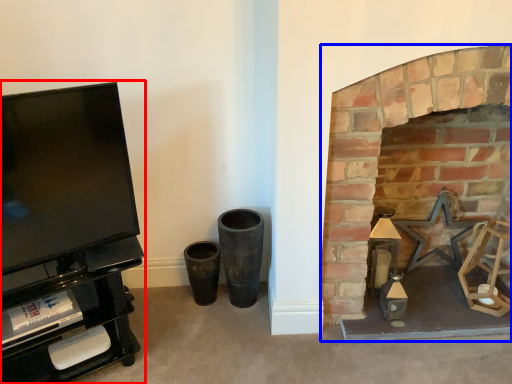
Question: Which object appears farthest to the camera in this image, entertainment center (highlighted by a red box) or fireplace (highlighted by a blue box)?

Choices:
 (A) entertainment center
 (B) fireplace

Answer: (B)